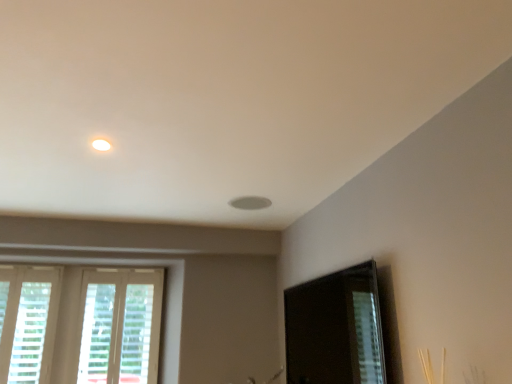
Question: Is white wooden window at lower left, which ranks as the first window in right-to-left order, spatially inside white textured blinds at lower left, which appears as the 1th window when viewed from the left, or outside of it?

Choices:
 (A) inside
 (B) outside

Answer: (B)

Question: Visually, is white wooden window at lower left, the second window when ordered from left to right, positioned to the left or to the right of white textured blinds at lower left, which appears as the 1th window when viewed from the left?

Choices:
 (A) left
 (B) right

Answer: (B)

Question: Which object is the farthest from the white textured blinds at lower left, which appears as the 1th window when viewed from the left?

Choices:
 (A) white wooden window at lower left, which ranks as the first window in right-to-left order
 (B) transparent glass screen door at lower right

Answer: (B)

Question: Estimate the real-world distances between objects in this image. Which object is closer to the white textured blinds at lower left, the second window when ordered from right to left?

Choices:
 (A) white wooden window at lower left, the second window when ordered from left to right
 (B) transparent glass screen door at lower right

Answer: (A)